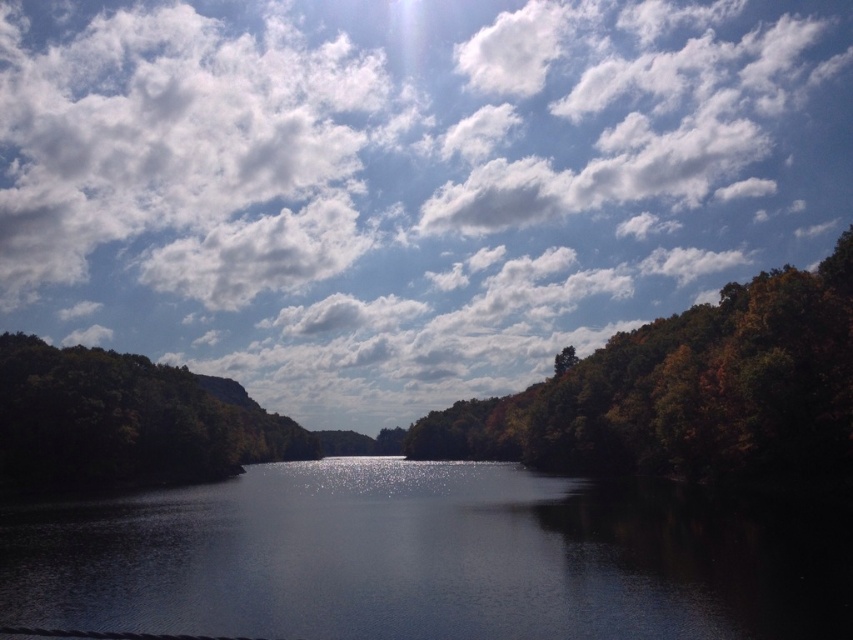
Question: Is dark reflective water at center to the left of green matte tree at left from the viewer's perspective?

Choices:
 (A) yes
 (B) no

Answer: (B)

Question: Estimate the real-world distances between objects in this image. Which object is farther from the green matte tree at left?

Choices:
 (A) autumn leaves at right
 (B) white fluffy cloud at upper center

Answer: (B)

Question: Estimate the real-world distances between objects in this image. Which object is closer to the green matte tree at left?

Choices:
 (A) autumn leaves at right
 (B) white fluffy cloud at upper center
 (C) dark reflective water at center

Answer: (C)

Question: Which object is closer to the camera taking this photo?

Choices:
 (A) white fluffy cloud at upper center
 (B) dark reflective water at center
 (C) green matte tree at left
 (D) autumn leaves at right

Answer: (B)

Question: Is dark reflective water at center wider than green matte tree at left?

Choices:
 (A) yes
 (B) no

Answer: (A)

Question: Is white fluffy cloud at upper center positioned before dark reflective water at center?

Choices:
 (A) yes
 (B) no

Answer: (B)